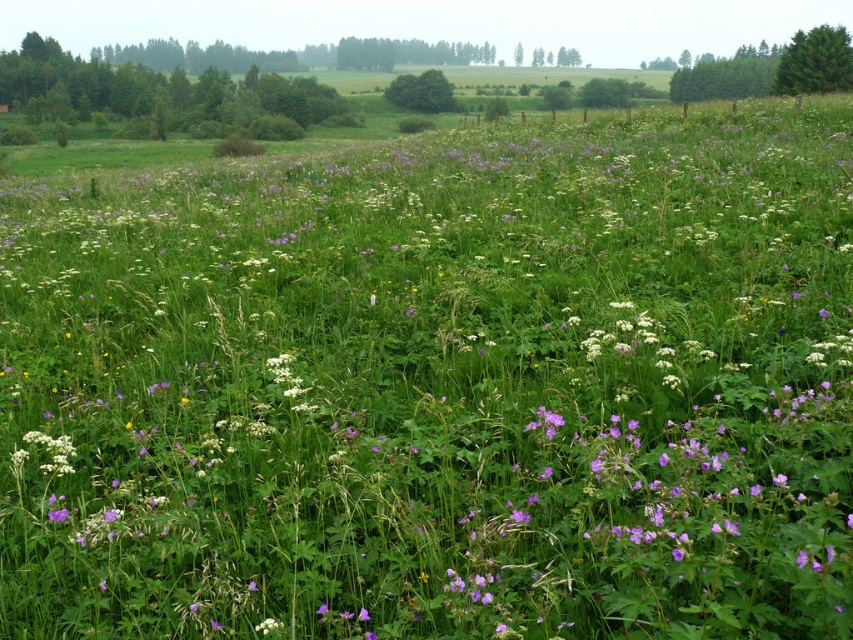
Consider the image. You are planning to plant a new tree in the meadow. The green matte tree at upper right and the green leafy tree at center are already there. Which tree has a narrower width, and therefore might require less space between it and the new tree?

The green matte tree at upper right has a narrower width than the green leafy tree at center, so it might require less space between it and the new tree.

You are standing in the meadow and want to take a photo of the green matte tree at upper right. Based on its position in the image, where should you aim your camera?

The green matte tree at upper right is located at the coordinates point (815, 61), so you should aim your camera towards the upper right corner of the scene to capture it.